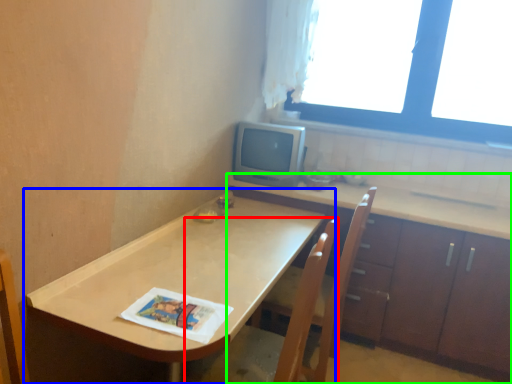
Question: Based on their relative distances, which object is farther from swivel chair (highlighted by a red box)? Choose from table (highlighted by a blue box) and cabinetry (highlighted by a green box).

Choices:
 (A) table
 (B) cabinetry

Answer: (B)